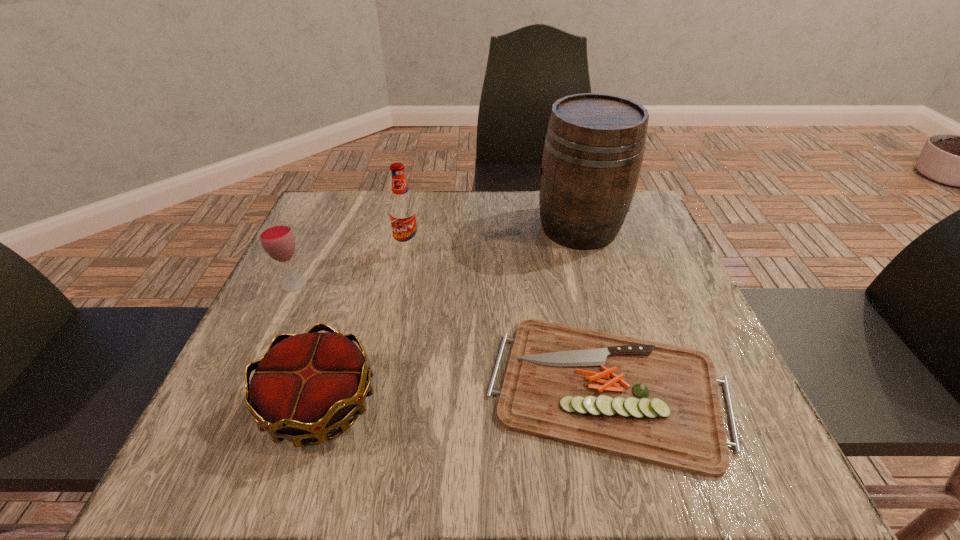
In order to click on vacant space that satisfies the following two spatial constraints: 1. on the front side of the fourth shortest object; 2. on the right side of the chopping board in this screenshot , I will do `click(381, 389)`.

Locate an element on the screen. This screenshot has height=540, width=960. blank space that satisfies the following two spatial constraints: 1. on the side of the cider near the bung hole; 2. on the front side of the second tallest object is located at coordinates (x=585, y=249).